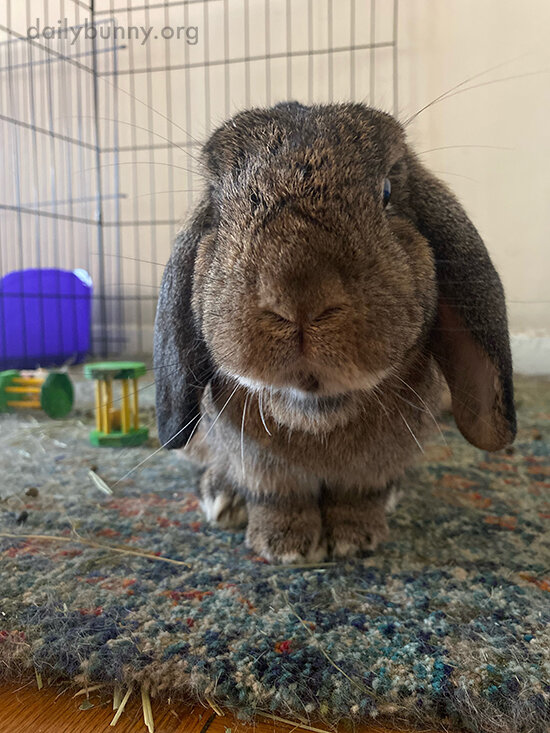
Where is `rabbit toys`? rabbit toys is located at coordinates (31, 330), (33, 399), (109, 374).